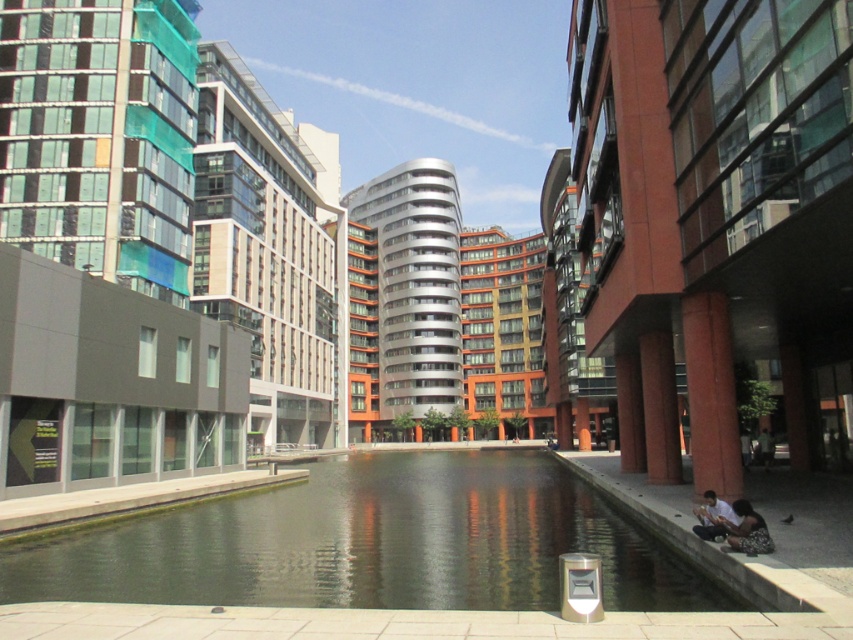
Is point (756, 515) less distant than point (705, 492)?

Yes, it is in front of point (705, 492).

Is point (761, 534) farther from viewer compared to point (724, 506)?

That is False.

What do you see at coordinates (746, 531) in the screenshot? This screenshot has width=853, height=640. I see `floral dress at lower right` at bounding box center [746, 531].

Where is `floral dress at lower right`? This screenshot has width=853, height=640. floral dress at lower right is located at coordinates (746, 531).

Can you confirm if clear water at center is bigger than light brown fabric shirt at lower right?

Correct, clear water at center is larger in size than light brown fabric shirt at lower right.

Between point (477, 524) and point (709, 540), which one is positioned behind?

The point (477, 524) is more distant.

Does point (238, 532) come closer to viewer compared to point (728, 509)?

That is False.

Where is `clear water at center`? The height and width of the screenshot is (640, 853). clear water at center is located at coordinates (369, 544).

Can you confirm if clear water at center is positioned above floral dress at lower right?

No.

Can you confirm if clear water at center is bigger than floral dress at lower right?

Indeed, clear water at center has a larger size compared to floral dress at lower right.

Is point (398, 600) positioned before point (729, 524)?

That is True.

Where is `clear water at center`? This screenshot has width=853, height=640. clear water at center is located at coordinates (369, 544).